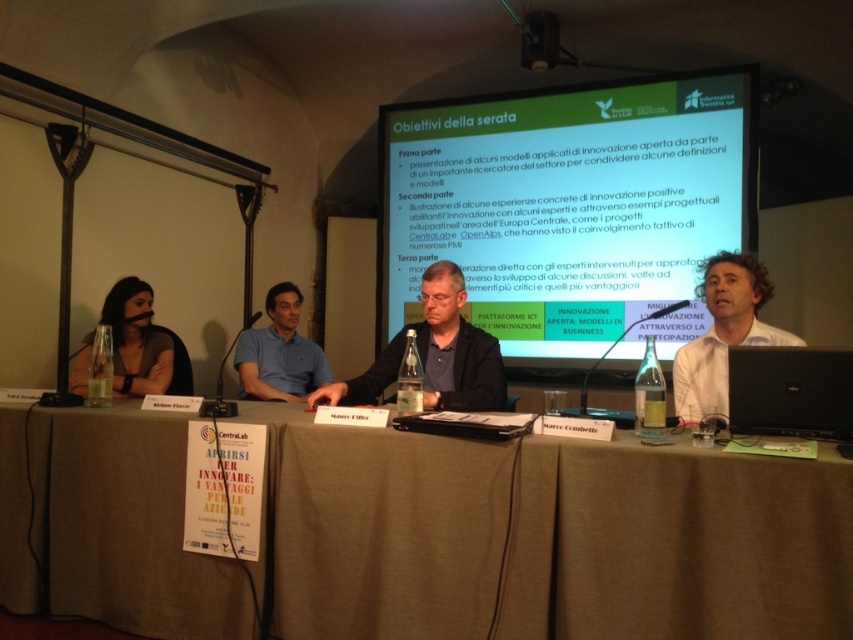
Is matte black shirt at center taller than matte black laptop at right?

Incorrect, matte black shirt at center's height is not larger of matte black laptop at right's.

Who is positioned more to the right, matte black shirt at center or matte black laptop at right?

Positioned to the right is matte black laptop at right.

Where is `matte black shirt at center`? The height and width of the screenshot is (640, 853). matte black shirt at center is located at coordinates (434, 355).

Between brown fabric table at lower center and matte black hair at left, which one has less height?

matte black hair at left is shorter.

Based on the photo, does brown fabric table at lower center have a smaller size compared to matte black hair at left?

Incorrect, brown fabric table at lower center is not smaller in size than matte black hair at left.

Between point (213, 577) and point (141, 349), which one is positioned behind?

Positioned behind is point (141, 349).

This screenshot has height=640, width=853. Find the location of `brown fabric table at lower center`. brown fabric table at lower center is located at coordinates (550, 538).

Is point (747, 280) in front of point (90, 340)?

Yes.

Is point (735, 316) farther from camera compared to point (132, 312)?

That is False.

Does point (674, 358) come closer to viewer compared to point (149, 392)?

Yes.

The width and height of the screenshot is (853, 640). Find the location of `matte black laptop at right`. matte black laptop at right is located at coordinates tap(723, 332).